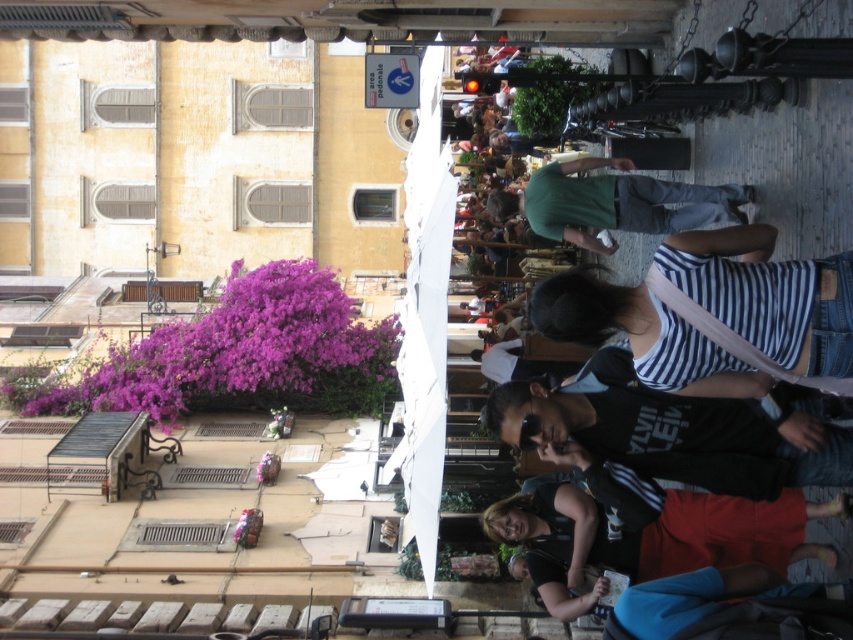
You see two people walking on the cobblestone street in the European city scene. They are wearing a striped cotton shirt at center and a green fabric shirt at center. Which one is more to the right?

The striped cotton shirt at center is positioned on the right side of green fabric shirt at center, so the striped cotton shirt at center is more to the right.

You are a photographer trying to capture a photo of the red skirt at lower right and the green fabric shirt at center. Based on their positions, which one should you focus on first to ensure both are in the frame?

The red skirt at lower right is much taller than the green fabric shirt at center, so you should focus on the red skirt at lower right first to ensure both are in the frame.

Looking at this image, you are a photographer trying to capture a candid shot of the striped cotton shirt at center and the red skirt at lower right. Which one should you focus on first if you want to capture both subjects in the same frame without moving your camera position?

The striped cotton shirt at center is positioned on the right side of red skirt at lower right, so you should focus on the red skirt at lower right first to ensure both subjects are in the frame.